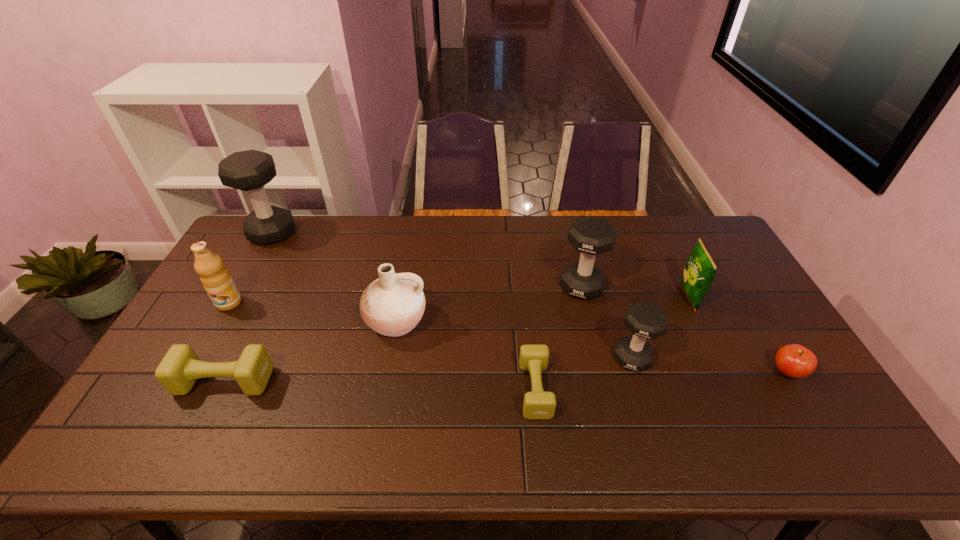
At what (x,y) coordinates should I click in order to perform the action: click on object situated at the far left corner. Please return your answer as a coordinate pair (x, y). The width and height of the screenshot is (960, 540). Looking at the image, I should click on (x=250, y=170).

Identify the location of vacant area at the far edge. This screenshot has height=540, width=960. (508, 226).

This screenshot has height=540, width=960. Find the location of `vacant space at the near edge of the desktop`. vacant space at the near edge of the desktop is located at coordinates (689, 438).

Locate an element on the screen. This screenshot has height=540, width=960. vacant area at the left edge is located at coordinates (242, 313).

Locate an element on the screen. vacant space at the right edge of the desktop is located at coordinates (755, 300).

In the image, there is a desktop. What are the coordinates of `vacant space at the far right corner` in the screenshot? It's located at (732, 255).

The image size is (960, 540). In the image, there is a desktop. What are the coordinates of `free space at the near right corner` in the screenshot? It's located at (846, 441).

The height and width of the screenshot is (540, 960). I want to click on empty space that is in between the olive oil and the bigger olive dumbbell, so click(x=227, y=342).

Where is `free space between the right olive dumbbell and the sixth object from right to left`? The width and height of the screenshot is (960, 540). free space between the right olive dumbbell and the sixth object from right to left is located at coordinates (466, 355).

Where is `blank region between the right olive dumbbell and the smallest gray dumbbell`? This screenshot has height=540, width=960. blank region between the right olive dumbbell and the smallest gray dumbbell is located at coordinates (584, 374).